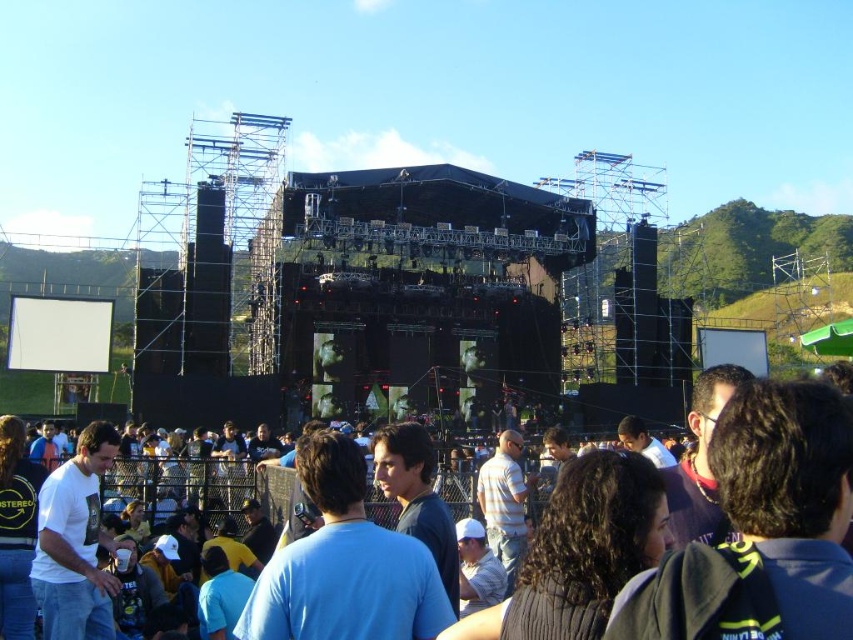
Question: Does blue cotton shirt at center appear under white cotton shirt at lower left?

Choices:
 (A) yes
 (B) no

Answer: (B)

Question: Which object appears farthest from the camera in this image?

Choices:
 (A) white cotton shirt at lower left
 (B) blue cotton shirt at center

Answer: (A)

Question: Is blue cotton shirt at center below white cotton shirt at lower left?

Choices:
 (A) no
 (B) yes

Answer: (A)

Question: Does blue cotton shirt at center appear over white cotton shirt at lower left?

Choices:
 (A) yes
 (B) no

Answer: (A)

Question: Which point appears closest to the camera in this image?

Choices:
 (A) (83, 561)
 (B) (276, 480)

Answer: (A)